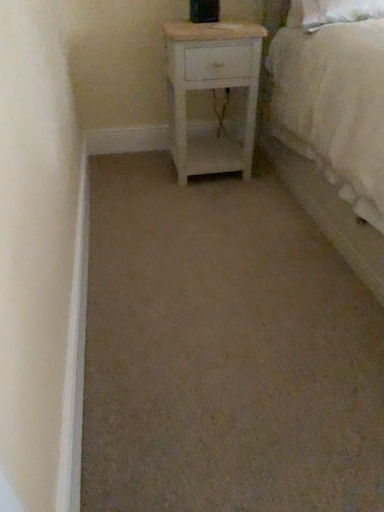
At what (x,y) coordinates should I click in order to perform the action: click on vacant space positioned to the left of white wood nightstand at center. Please return your answer as a coordinate pair (x, y). The image size is (384, 512). Looking at the image, I should click on (145, 173).